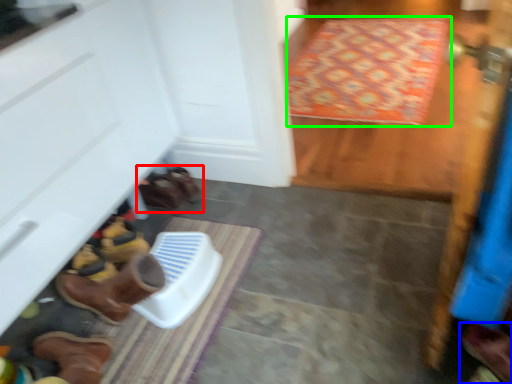
Question: Which is nearer to the footwear (highlighted by a red box)? footwear (highlighted by a blue box) or doormat (highlighted by a green box).

Choices:
 (A) footwear
 (B) doormat

Answer: (A)